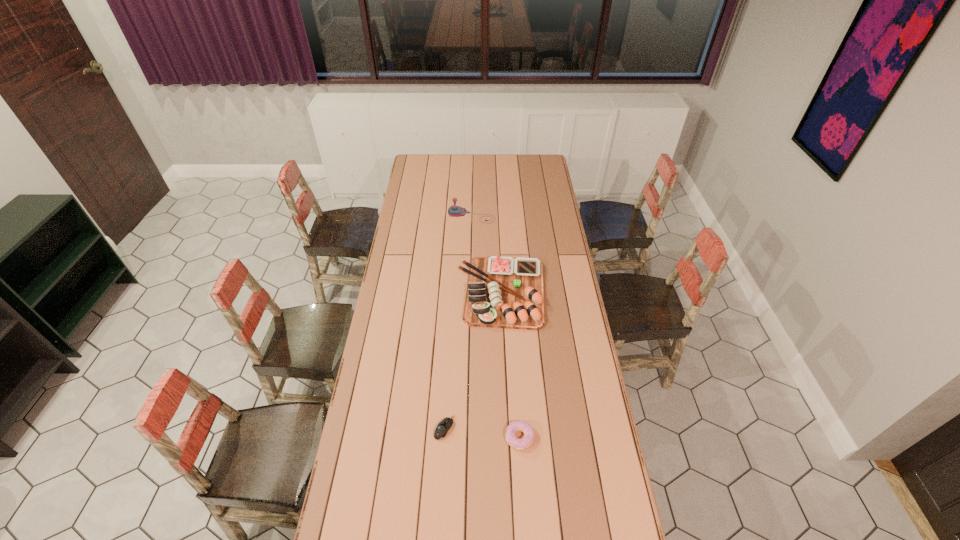
Where is `vacant space that is in between the second tallest object and the shortest object`? This screenshot has height=540, width=960. vacant space that is in between the second tallest object and the shortest object is located at coordinates (473, 360).

Find the location of a particular element. Image resolution: width=960 pixels, height=540 pixels. free spot between the shortest object and the third shortest object is located at coordinates (473, 360).

Locate an element on the screen. This screenshot has height=540, width=960. vacant area that lies between the farthest object and the shortest object is located at coordinates (458, 322).

Find the location of a particular element. object that is the third closest to the farthest object is located at coordinates (516, 443).

Locate an element on the screen. This screenshot has height=540, width=960. object identified as the third closest to the second tallest object is located at coordinates (516, 443).

Identify the location of vacant space that satisfies the following two spatial constraints: 1. on the back side of the shortest object; 2. on the right side of the second tallest object. (453, 292).